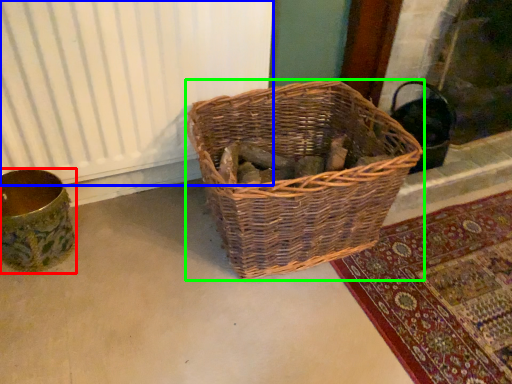
Question: Based on their relative distances, which object is nearer to flower basket (highlighted by a red box)? Choose from radiator (highlighted by a blue box) and picnic basket (highlighted by a green box).

Choices:
 (A) radiator
 (B) picnic basket

Answer: (A)